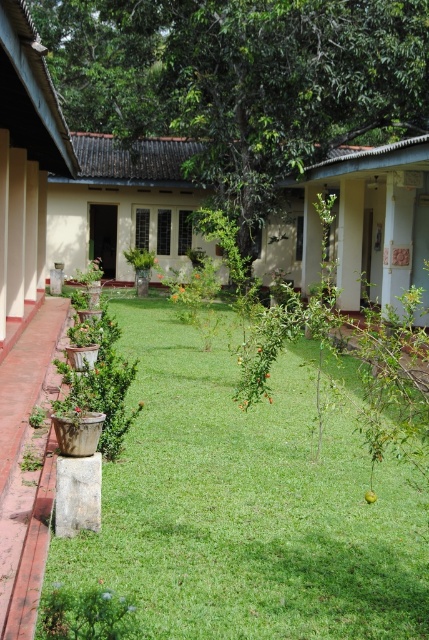
Which of these two, green grass at center or green leafy tree at center, stands taller?

With more height is green leafy tree at center.

Is point (271, 484) closer to viewer compared to point (238, 179)?

Yes, point (271, 484) is in front of point (238, 179).

Image resolution: width=429 pixels, height=640 pixels. In order to click on green grass at center in this screenshot , I will do `click(247, 506)`.

Locate an element on the screen. The height and width of the screenshot is (640, 429). green grass at center is located at coordinates (247, 506).